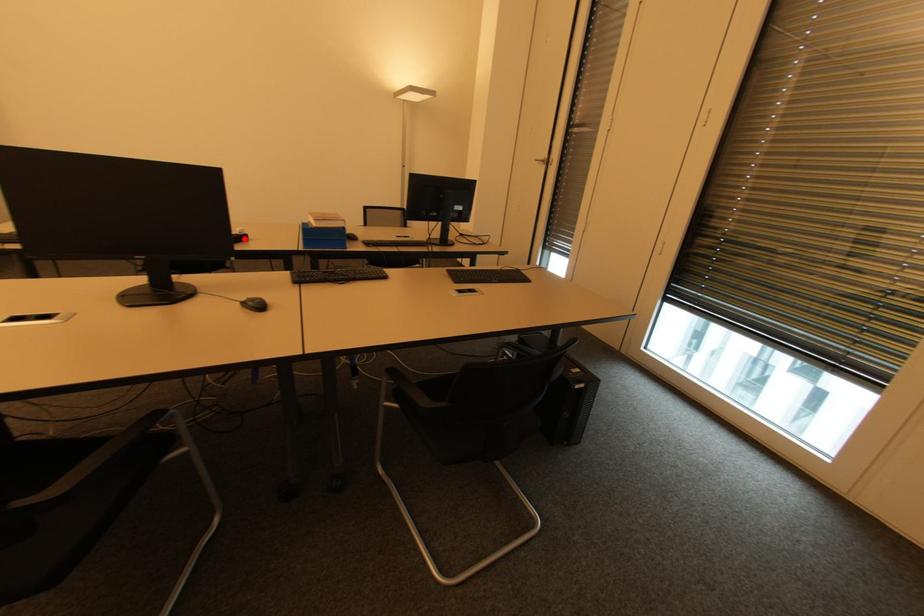
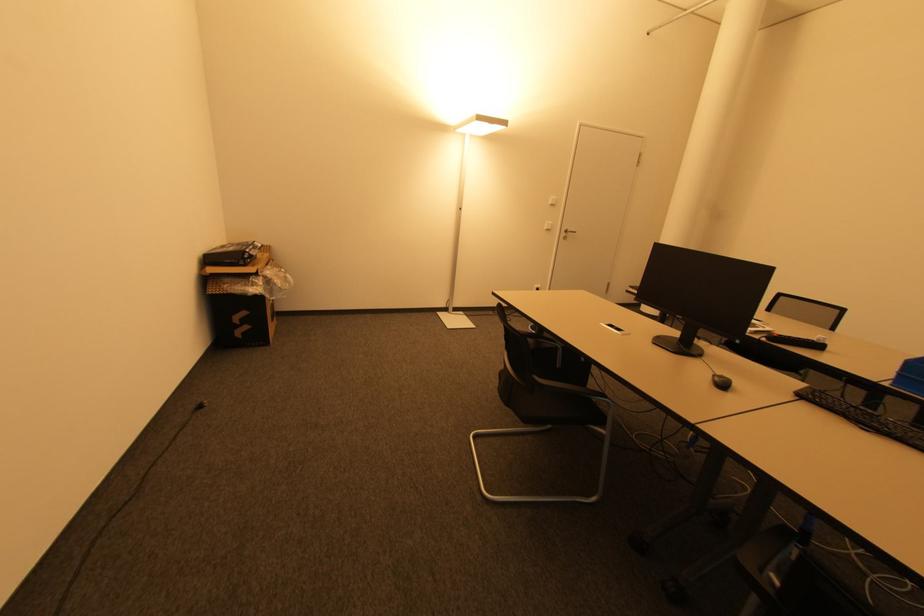
Find the pixel in the second image that matches the highlighted location in the first image.

(819, 346)